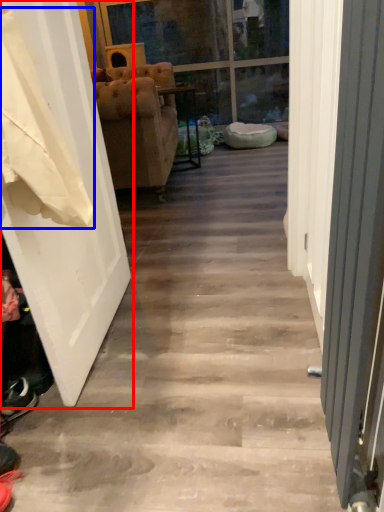
Question: Which object appears farthest to the camera in this image, door (highlighted by a red box) or laundry (highlighted by a blue box)?

Choices:
 (A) door
 (B) laundry

Answer: (A)